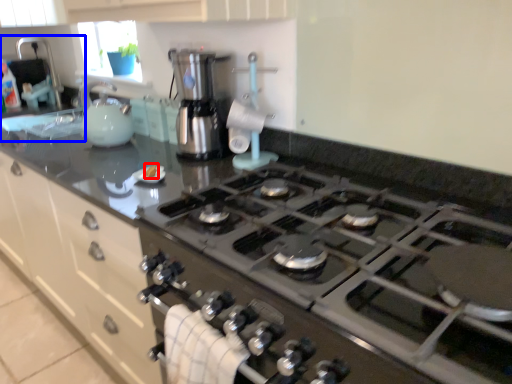
Question: Which point is further to the camera, food (highlighted by a red box) or sink (highlighted by a blue box)?

Choices:
 (A) food
 (B) sink

Answer: (B)